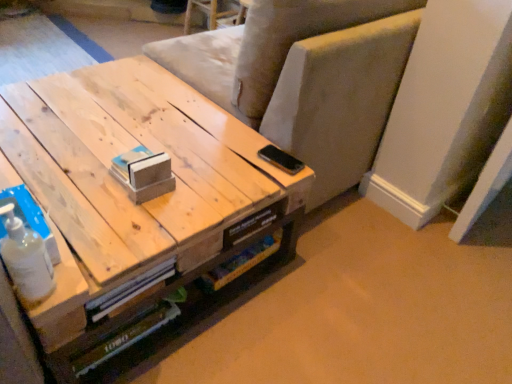
Question: Considering the relative sizes of natural wood table at center and white matte bottle at lower left in the image provided, is natural wood table at center thinner than white matte bottle at lower left?

Choices:
 (A) yes
 (B) no

Answer: (B)

Question: Is natural wood table at center positioned with its back to white matte bottle at lower left?

Choices:
 (A) no
 (B) yes

Answer: (A)

Question: Does natural wood table at center come in front of white matte bottle at lower left?

Choices:
 (A) no
 (B) yes

Answer: (A)

Question: Does natural wood table at center lie behind white matte bottle at lower left?

Choices:
 (A) no
 (B) yes

Answer: (B)

Question: Can white matte bottle at lower left be found inside natural wood table at center?

Choices:
 (A) yes
 (B) no

Answer: (B)

Question: Can you confirm if natural wood table at center is taller than white matte bottle at lower left?

Choices:
 (A) yes
 (B) no

Answer: (A)

Question: Does light beige fabric armchair at upper center come in front of white matte bottle at lower left?

Choices:
 (A) no
 (B) yes

Answer: (A)

Question: Is white matte bottle at lower left at the back of light beige fabric armchair at upper center?

Choices:
 (A) yes
 (B) no

Answer: (B)

Question: Is light beige fabric armchair at upper center positioned behind white matte bottle at lower left?

Choices:
 (A) no
 (B) yes

Answer: (B)

Question: From a real-world perspective, is light beige fabric armchair at upper center positioned over white matte bottle at lower left based on gravity?

Choices:
 (A) yes
 (B) no

Answer: (B)

Question: Can you confirm if light beige fabric armchair at upper center is taller than white matte bottle at lower left?

Choices:
 (A) no
 (B) yes

Answer: (B)

Question: Considering the relative sizes of light beige fabric armchair at upper center and white matte bottle at lower left in the image provided, is light beige fabric armchair at upper center wider than white matte bottle at lower left?

Choices:
 (A) yes
 (B) no

Answer: (A)

Question: Can you confirm if natural wood table at center is bigger than light beige fabric armchair at upper center?

Choices:
 (A) yes
 (B) no

Answer: (B)